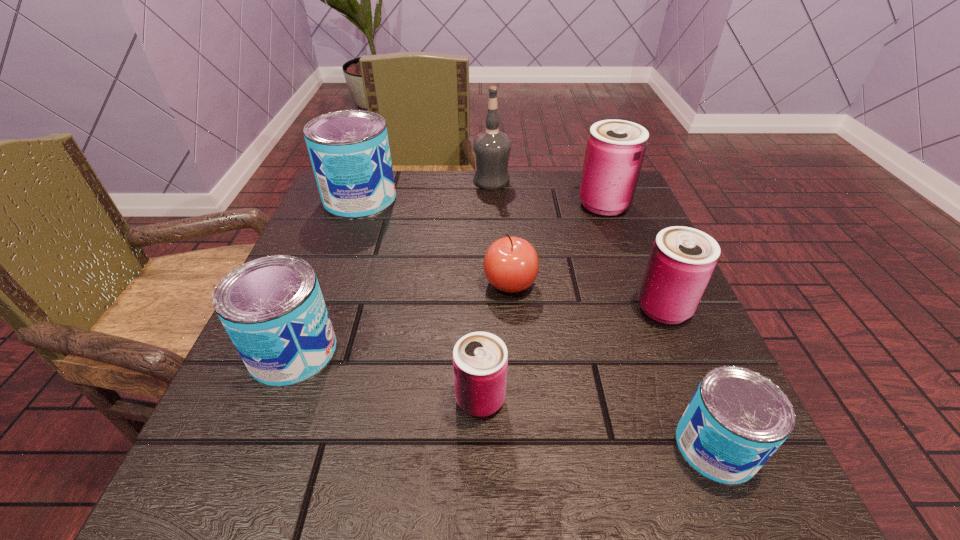
The width and height of the screenshot is (960, 540). What are the coordinates of `vodka situated at the far edge` in the screenshot? It's located at (491, 148).

Identify the location of object that is at the near edge. (737, 418).

Image resolution: width=960 pixels, height=540 pixels. I want to click on object that is at the far left corner, so [x=349, y=150].

What are the coordinates of `object that is at the far right corner` in the screenshot? It's located at click(615, 150).

At what (x,y) coordinates should I click in order to perform the action: click on object that is at the near right corner. Please return your answer as a coordinate pair (x, y). Looking at the image, I should click on (737, 418).

I want to click on vacant region at the far edge of the desktop, so click(525, 205).

This screenshot has width=960, height=540. I want to click on vacant space at the near edge of the desktop, so pyautogui.click(x=365, y=478).

Where is `vacant point at the left edge`? vacant point at the left edge is located at coordinates (347, 299).

I want to click on vacant space at the far left corner, so click(334, 215).

Find the location of `free region at the near left corner of the desktop`. free region at the near left corner of the desktop is located at coordinates (206, 453).